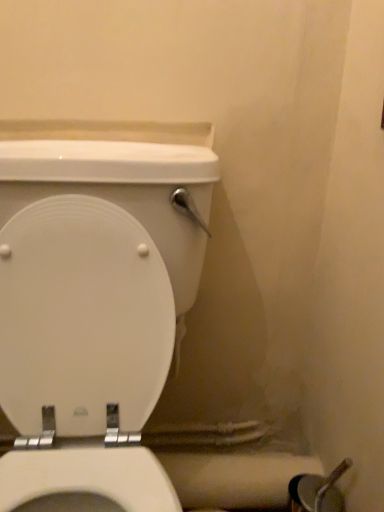
Question: Looking at the image, does white glossy toilet at center seem bigger or smaller compared to white matte toilet paper at lower right?

Choices:
 (A) big
 (B) small

Answer: (A)

Question: Looking at their shapes, would you say white glossy toilet at center is wider or thinner than white matte toilet paper at lower right?

Choices:
 (A) wide
 (B) thin

Answer: (A)

Question: From the image's perspective, is white glossy toilet at center positioned above or below white matte toilet paper at lower right?

Choices:
 (A) above
 (B) below

Answer: (A)

Question: Is point (200, 467) closer or farther from the camera than point (190, 268)?

Choices:
 (A) farther
 (B) closer

Answer: (A)

Question: Based on their positions, is white matte toilet paper at lower right located to the left or right of white glossy toilet at center?

Choices:
 (A) right
 (B) left

Answer: (A)

Question: From a real-world perspective, is white matte toilet paper at lower right positioned above or below white glossy toilet at center?

Choices:
 (A) above
 (B) below

Answer: (B)

Question: Looking at their shapes, would you say white matte toilet paper at lower right is wider or thinner than white glossy toilet at center?

Choices:
 (A) thin
 (B) wide

Answer: (A)